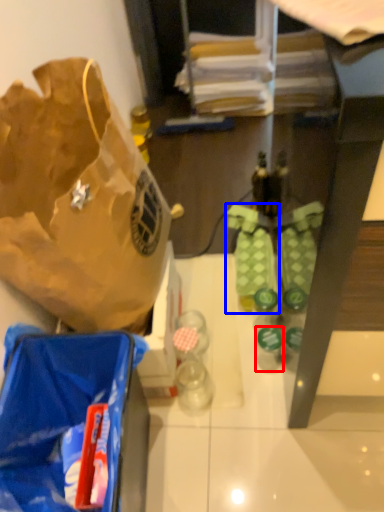
Question: Which of the following is the farthest to the observer, bottle (highlighted by a red box) or footwear (highlighted by a blue box)?

Choices:
 (A) bottle
 (B) footwear

Answer: (B)